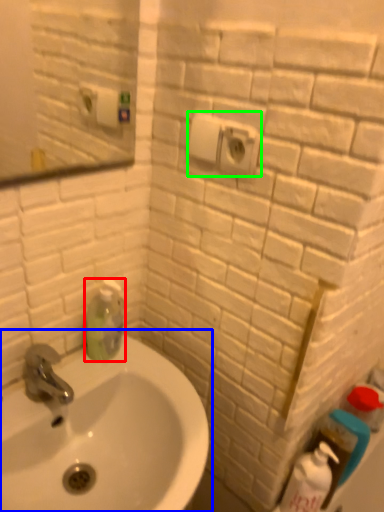
Question: Which object is the closest to the cleaning product (highlighted by a red box)? Choose among these: sink (highlighted by a blue box) or electric outlet (highlighted by a green box).

Choices:
 (A) sink
 (B) electric outlet

Answer: (A)